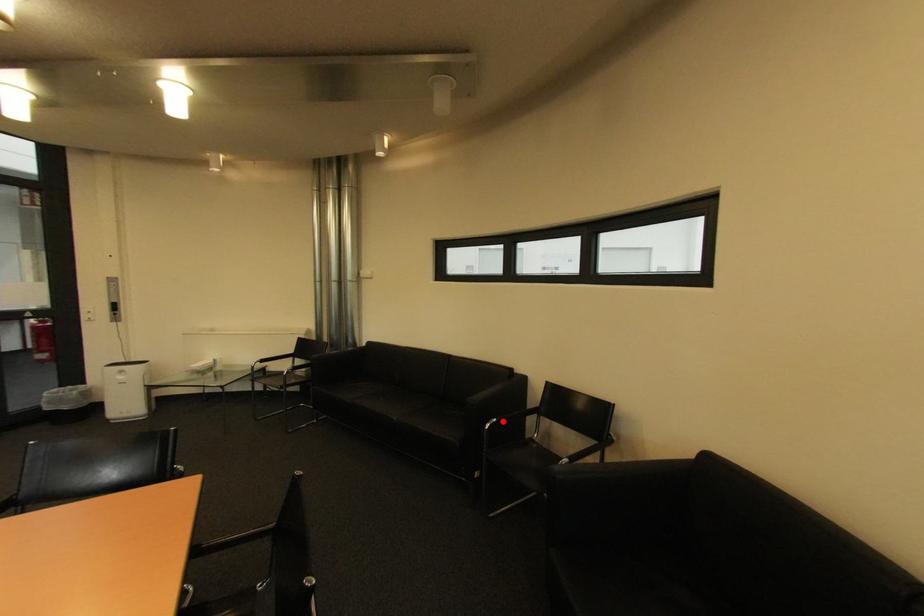
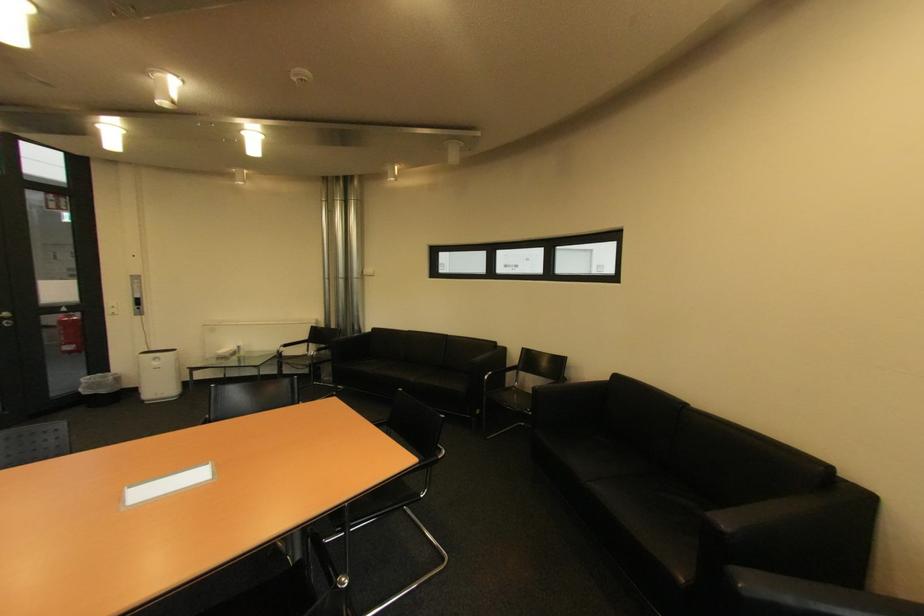
Question: I am providing you with two images of the same scene from different viewpoints. Given a red point in image1, look at the same physical point in image2. Is it:

Choices:
 (A) Closer to the viewpoint
 (B) Farther from the viewpoint

Answer: (A)